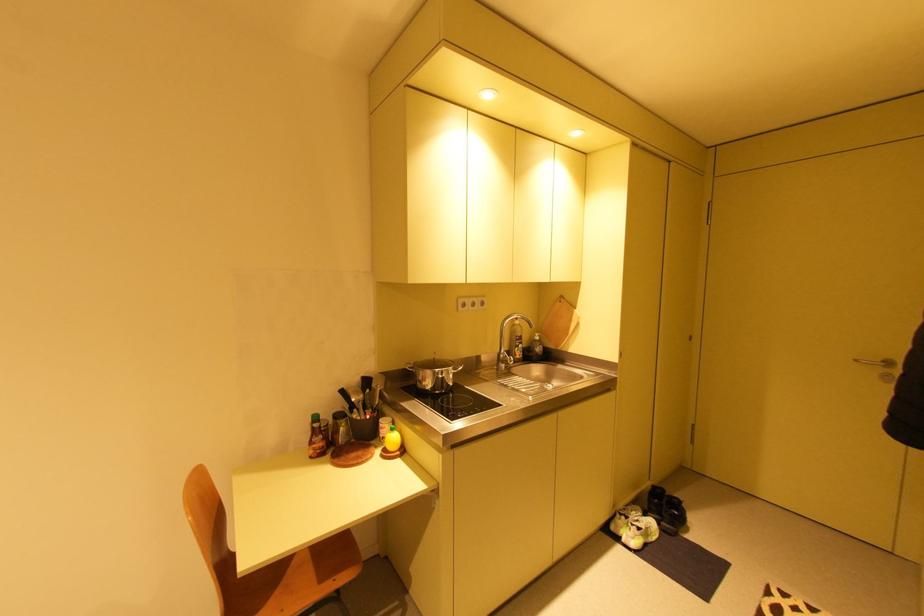
Image resolution: width=924 pixels, height=616 pixels. Identify the location of brown sauce bottle. (315, 438).